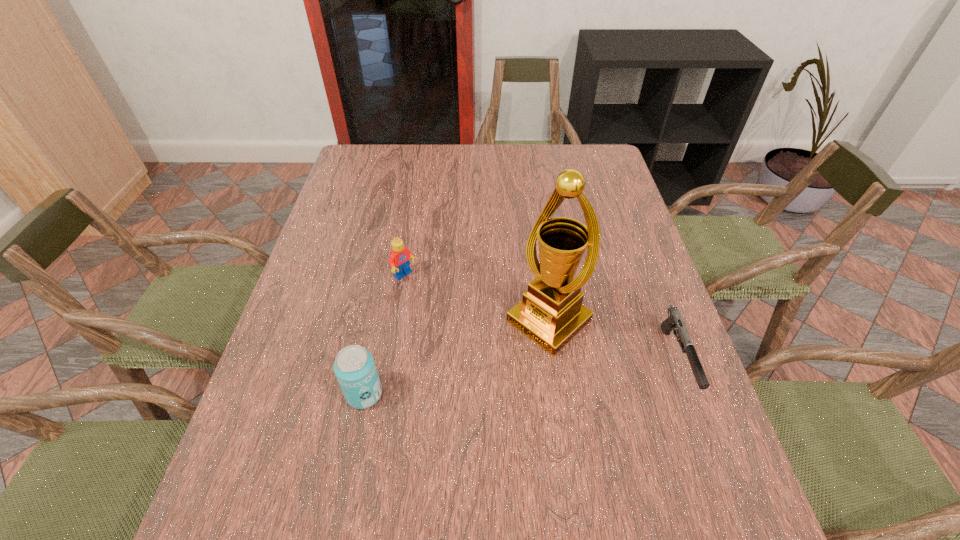
Find the location of a particular element. The image size is (960, 540). vacant position located on the front-facing side of the third object from left to right is located at coordinates (407, 446).

Find the location of `blank space located 0.160m on the face of the Lego`. blank space located 0.160m on the face of the Lego is located at coordinates (454, 318).

Identify the location of vacant space positioned 0.150m on the face of the Lego. The height and width of the screenshot is (540, 960). (451, 315).

This screenshot has width=960, height=540. I want to click on vacant area located on the face of the Lego, so click(468, 330).

Identify the location of object that is at the right edge. This screenshot has width=960, height=540. 674,322.

Identify the location of free space at the far edge. (468, 152).

In the image, there is a desktop. Identify the location of vacant area at the near edge. (404, 463).

Identify the location of free space at the left edge. (360, 279).

I want to click on free space at the right edge of the desktop, so click(x=636, y=251).

This screenshot has height=540, width=960. What are the coordinates of `vacant point at the far left corner` in the screenshot? It's located at (369, 159).